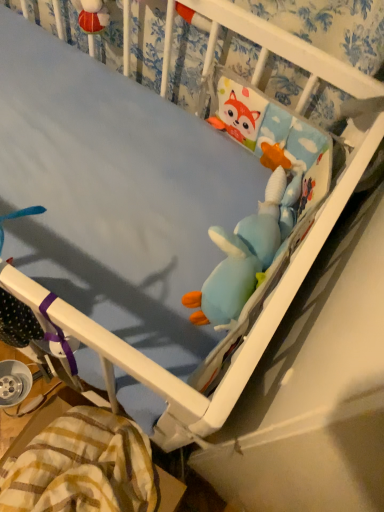
Question: Should I look upward or downward to see soft plush toy at upper right, which ranks as the first toy in top-to-bottom order?

Choices:
 (A) up
 (B) down

Answer: (A)

Question: Are yellow plaid blanket at lower left and blue plush toy at center, the 1th toy in the bottom-to-top sequence, far apart?

Choices:
 (A) yes
 (B) no

Answer: (B)

Question: Is yellow plaid blanket at lower left completely or partially outside of blue plush toy at center, the 1th toy in the bottom-to-top sequence?

Choices:
 (A) no
 (B) yes

Answer: (B)

Question: From the image's perspective, is yellow plaid blanket at lower left under blue plush toy at center, the 1th toy in the bottom-to-top sequence?

Choices:
 (A) no
 (B) yes

Answer: (B)

Question: Is yellow plaid blanket at lower left positioned with its back to blue plush toy at center, which is counted as the second toy, starting from the top?

Choices:
 (A) no
 (B) yes

Answer: (A)

Question: Considering the relative sizes of yellow plaid blanket at lower left and blue plush toy at center, the 1th toy in the bottom-to-top sequence, in the image provided, is yellow plaid blanket at lower left smaller than blue plush toy at center, the 1th toy in the bottom-to-top sequence,?

Choices:
 (A) no
 (B) yes

Answer: (A)

Question: Can you confirm if yellow plaid blanket at lower left is taller than blue plush toy at center, the 1th toy in the bottom-to-top sequence?

Choices:
 (A) no
 (B) yes

Answer: (B)

Question: Considering the relative sizes of soft plush toy at upper right, which ranks as the first toy in top-to-bottom order, and yellow plaid blanket at lower left in the image provided, is soft plush toy at upper right, which ranks as the first toy in top-to-bottom order, taller than yellow plaid blanket at lower left?

Choices:
 (A) yes
 (B) no

Answer: (B)

Question: Does soft plush toy at upper right, which ranks as the first toy in top-to-bottom order, lie behind yellow plaid blanket at lower left?

Choices:
 (A) no
 (B) yes

Answer: (B)

Question: Considering the relative positions of soft plush toy at upper right, which ranks as the first toy in top-to-bottom order, and yellow plaid blanket at lower left in the image provided, is soft plush toy at upper right, which ranks as the first toy in top-to-bottom order, to the right of yellow plaid blanket at lower left from the viewer's perspective?

Choices:
 (A) yes
 (B) no

Answer: (A)

Question: Is soft plush toy at upper right, which ranks as the first toy in top-to-bottom order, shorter than yellow plaid blanket at lower left?

Choices:
 (A) no
 (B) yes

Answer: (B)

Question: From a real-world perspective, is soft plush toy at upper right, acting as the 2th toy starting from the bottom, located beneath yellow plaid blanket at lower left?

Choices:
 (A) no
 (B) yes

Answer: (A)

Question: Can you confirm if soft plush toy at upper right, acting as the 2th toy starting from the bottom, is thinner than yellow plaid blanket at lower left?

Choices:
 (A) no
 (B) yes

Answer: (B)

Question: Is the position of blue plush toy at center, which is counted as the second toy, starting from the top, less distant than that of yellow plaid blanket at lower left?

Choices:
 (A) no
 (B) yes

Answer: (B)